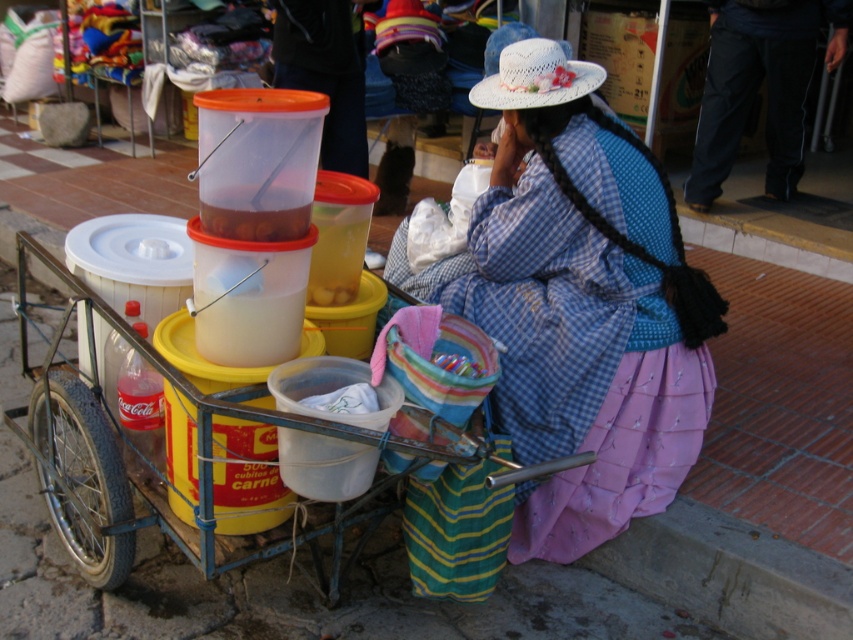
Which is above, blue plaid dress at center or white woven hat at upper center?

white woven hat at upper center

Which of these two, blue plaid dress at center or white woven hat at upper center, stands taller?

blue plaid dress at center is taller.

At what (x,y) coordinates should I click in order to perform the action: click on blue plaid dress at center. Please return your answer as a coordinate pair (x, y). Looking at the image, I should click on (582, 307).

Where is `blue plaid dress at center`? blue plaid dress at center is located at coordinates (582, 307).

Who is more forward, (190, 541) or (770, 124)?

Positioned in front is point (190, 541).

Is plastic cart at center smaller than black cotton pants at lower right?

Incorrect, plastic cart at center is not smaller in size than black cotton pants at lower right.

Measure the distance between plastic cart at center and camera.

plastic cart at center is 1.65 meters from camera.

At what (x,y) coordinates should I click in order to perform the action: click on plastic cart at center. Please return your answer as a coordinate pair (x, y). The width and height of the screenshot is (853, 640). Looking at the image, I should click on (207, 460).

Can you confirm if plastic cart at center is wider than white woven hat at upper center?

Indeed, plastic cart at center has a greater width compared to white woven hat at upper center.

Does plastic cart at center appear over white woven hat at upper center?

Actually, plastic cart at center is below white woven hat at upper center.

Measure the distance between plastic cart at center and camera.

plastic cart at center is 5.43 feet away from camera.

I want to click on plastic cart at center, so click(207, 460).